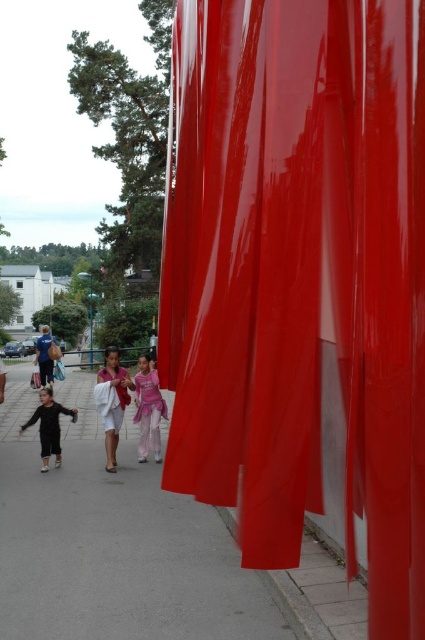
Who is higher up, white cotton dress at center or matte blue jeans at left?

Positioned higher is matte blue jeans at left.

Can you confirm if white cotton dress at center is positioned below matte blue jeans at left?

Correct, white cotton dress at center is located below matte blue jeans at left.

At what (x,y) coordinates should I click in order to perform the action: click on white cotton dress at center. Please return your answer as a coordinate pair (x, y). Looking at the image, I should click on (112, 403).

Is glossy plastic curtain at right below matte blue jeans at left?

Incorrect, glossy plastic curtain at right is not positioned below matte blue jeans at left.

What do you see at coordinates (300, 275) in the screenshot? This screenshot has height=640, width=425. I see `glossy plastic curtain at right` at bounding box center [300, 275].

Who is more forward, (399, 536) or (36, 353)?

Point (399, 536) is more forward.

This screenshot has height=640, width=425. I want to click on glossy plastic curtain at right, so (x=300, y=275).

Does point (288, 419) lie behind point (112, 404)?

That is False.

Where is `glossy plastic curtain at right`? The height and width of the screenshot is (640, 425). glossy plastic curtain at right is located at coordinates (300, 275).

Where is `glossy plastic curtain at right`? The height and width of the screenshot is (640, 425). glossy plastic curtain at right is located at coordinates point(300,275).